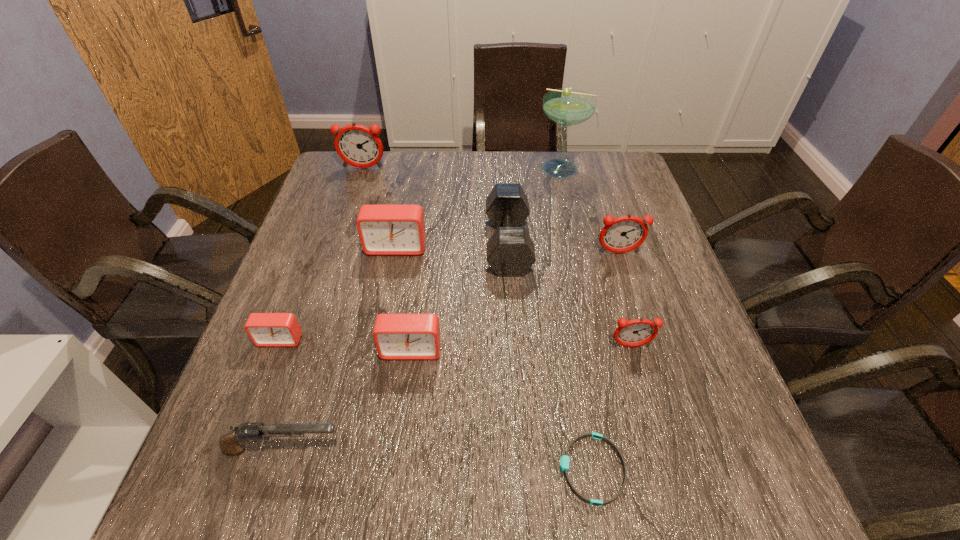
The width and height of the screenshot is (960, 540). Find the location of `free spot located 0.190m on the front-facing side of the smallest reddish-pink alarm clock`. free spot located 0.190m on the front-facing side of the smallest reddish-pink alarm clock is located at coordinates (659, 442).

The width and height of the screenshot is (960, 540). In order to click on vacant space located 0.220m aiming along the barrel of the gun in this screenshot , I will do `click(473, 450)`.

This screenshot has height=540, width=960. I want to click on free space located on the front-facing side of the leftmost red alarm clock, so click(245, 433).

Locate an element on the screen. This screenshot has height=540, width=960. blank area located 0.100m on the buckle of the shortest object is located at coordinates (499, 469).

Locate an element on the screen. Image resolution: width=960 pixels, height=540 pixels. blank space located on the buckle of the shortest object is located at coordinates (342, 469).

The height and width of the screenshot is (540, 960). I want to click on vacant space located 0.280m on the buckle of the shortest object, so click(x=391, y=469).

You are a GUI agent. You are given a task and a screenshot of the screen. Output one action in this format:
    pyautogui.click(x=<x>, y=<y>)
    Task: Click on the martini present at the far edge
    The image size is (960, 540).
    Given the screenshot: What is the action you would take?
    pyautogui.click(x=566, y=106)

Find the location of a particular element. Image resolution: width=960 pixels, height=540 pixels. alarm clock present at the far edge is located at coordinates (358, 146).

The width and height of the screenshot is (960, 540). Find the location of `object that is at the near edge`. object that is at the near edge is located at coordinates (564, 461).

Where is `gun that is at the left edge`? gun that is at the left edge is located at coordinates (230, 443).